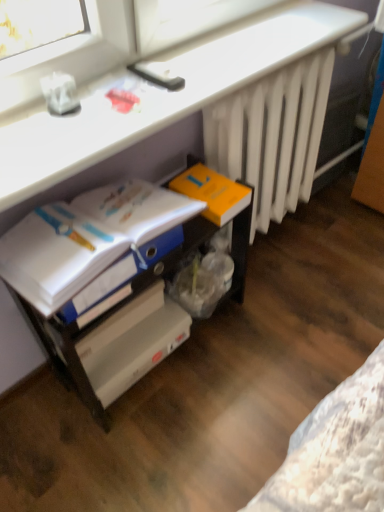
This screenshot has height=512, width=384. Find the location of `orange matte paperback book at center-right`. orange matte paperback book at center-right is located at coordinates (213, 193).

Locate an element on the screen. white plastic file cabinet at lower center is located at coordinates (136, 300).

Where is `white matte radiator at right`? This screenshot has width=384, height=512. white matte radiator at right is located at coordinates (272, 135).

Between blue glossy folder at lower left and white plastic computer at lower left, which one appears on the left side from the viewer's perspective?

blue glossy folder at lower left is more to the left.

From a real-world perspective, is blue glossy folder at lower left over white plastic computer at lower left?

Incorrect, from a real-world perspective, blue glossy folder at lower left is lower than white plastic computer at lower left.

Would you say white plastic computer at lower left is part of blue glossy folder at lower left's contents?

Definitely not — white plastic computer at lower left is not inside blue glossy folder at lower left.

Does blue glossy folder at lower left have a smaller size compared to white plastic file cabinet at lower center?

Correct, blue glossy folder at lower left occupies less space than white plastic file cabinet at lower center.

From the image's perspective, is blue glossy folder at lower left on top of white plastic file cabinet at lower center?

Yes, from the image's perspective, blue glossy folder at lower left is over white plastic file cabinet at lower center.

Are blue glossy folder at lower left and white plastic file cabinet at lower center located far from each other?

blue glossy folder at lower left is near white plastic file cabinet at lower center, not far away.

From a real-world perspective, is blue glossy folder at lower left positioned above or below white plastic file cabinet at lower center?

Clearly, from a real-world perspective, blue glossy folder at lower left is above white plastic file cabinet at lower center.

Who is taller, white plastic computer at lower left or white matte radiator at right?

white matte radiator at right is taller.

Is white plastic computer at lower left oriented away from white matte radiator at right?

white plastic computer at lower left is not turned away from white matte radiator at right.

In the scene shown: Which object is wider, white plastic computer at lower left or white matte radiator at right?

With larger width is white plastic computer at lower left.

Is white plastic computer at lower left positioned beyond the bounds of white matte radiator at right?

Yes.

Which object is wider, white plastic computer at lower left or orange matte paperback book at center-right?

white plastic computer at lower left is wider.

Which is more to the right, white plastic computer at lower left or orange matte paperback book at center-right?

orange matte paperback book at center-right is more to the right.

From a real-world perspective, is white plastic computer at lower left located beneath orange matte paperback book at center-right?

No, from a real-world perspective, white plastic computer at lower left is not under orange matte paperback book at center-right.

Based on the photo, how much distance is there between white plastic computer at lower left and orange matte paperback book at center-right?

12.42 inches.

Considering the sizes of white plastic file cabinet at lower center and white matte radiator at right in the image, is white plastic file cabinet at lower center taller or shorter than white matte radiator at right?

In the image, white plastic file cabinet at lower center appears to be shorter than white matte radiator at right.

Looking at this image, from the image's perspective, which one is positioned higher, white plastic file cabinet at lower center or white matte radiator at right?

white matte radiator at right.

Looking at the image, does white plastic file cabinet at lower center seem bigger or smaller compared to white matte radiator at right?

Considering their sizes, white plastic file cabinet at lower center takes up more space than white matte radiator at right.

Is white plastic file cabinet at lower center facing towards white matte radiator at right?

No, white plastic file cabinet at lower center is not oriented towards white matte radiator at right.

From their relative heights in the image, would you say white matte radiator at right is taller or shorter than blue glossy folder at lower left?

Considering their sizes, white matte radiator at right has more height than blue glossy folder at lower left.

Is white matte radiator at right in front of or behind blue glossy folder at lower left in the image?

white matte radiator at right is positioned farther from the viewer than blue glossy folder at lower left.

Is white matte radiator at right facing away from blue glossy folder at lower left?

No.

Is white matte radiator at right directly adjacent to blue glossy folder at lower left?

No, white matte radiator at right is not in contact with blue glossy folder at lower left.

Are white plastic computer at lower left and blue glossy folder at lower left beside each other?

No, white plastic computer at lower left is not beside blue glossy folder at lower left.

Is the position of white plastic computer at lower left more distant than that of blue glossy folder at lower left?

No, white plastic computer at lower left is in front of blue glossy folder at lower left.

From a real-world perspective, is white plastic computer at lower left positioned above or below blue glossy folder at lower left?

Clearly, from a real-world perspective, white plastic computer at lower left is above blue glossy folder at lower left.

Is white plastic computer at lower left smaller than blue glossy folder at lower left?

No, white plastic computer at lower left is not smaller than blue glossy folder at lower left.

Where is `computer located above the blue glossy folder at lower left (from the image's perspective)`? computer located above the blue glossy folder at lower left (from the image's perspective) is located at coordinates (160, 97).

At what (x,y) coordinates should I click in order to perform the action: click on magazine in front of the white plastic file cabinet at lower center. Please return your answer as a coordinate pair (x, y). Looking at the image, I should click on (87, 239).

Which object lies nearer to the anchor point orange matte paperback book at center-right, white matte radiator at right or white plastic file cabinet at lower center?

white plastic file cabinet at lower center is positioned closer to the anchor orange matte paperback book at center-right.

Considering their positions, is blue glossy folder at lower left positioned closer to white matte radiator at right than white plastic file cabinet at lower center?

white plastic file cabinet at lower center lies closer to white matte radiator at right than the other object.

Which object lies further to the anchor point blue glossy folder at lower left, white plastic computer at lower left or white matte radiator at right?

Among the two, white matte radiator at right is located further to blue glossy folder at lower left.

Considering their positions, is orange matte paperback book at center-right positioned further to blue glossy folder at lower left than white matte radiator at right?

white matte radiator at right is further to blue glossy folder at lower left.

Estimate the real-world distances between objects in this image. Which object is closer to white plastic computer at lower left, white plastic file cabinet at lower center or orange matte paperback book at center-right?

Among the two, orange matte paperback book at center-right is located nearer to white plastic computer at lower left.

When comparing their distances from white plastic computer at lower left, does white matte radiator at right or blue glossy folder at lower left seem closer?

Among the two, blue glossy folder at lower left is located nearer to white plastic computer at lower left.

Which object lies nearer to the anchor point white plastic file cabinet at lower center, white plastic computer at lower left or white matte radiator at right?

Based on the image, white plastic computer at lower left appears to be nearer to white plastic file cabinet at lower center.

From the image, which object appears to be farther from white matte radiator at right, white plastic file cabinet at lower center or orange matte paperback book at center-right?

white plastic file cabinet at lower center lies further to white matte radiator at right than the other object.

The image size is (384, 512). Identify the location of paperback book located between blue glossy folder at lower left and white matte radiator at right in the left-right direction. (213, 193).

Locate an element on the screen. The height and width of the screenshot is (512, 384). file cabinet positioned between blue glossy folder at lower left and orange matte paperback book at center-right from near to far is located at coordinates (136, 300).

Where is `radiator that lies between white plastic computer at lower left and white plastic file cabinet at lower center from top to bottom`? The image size is (384, 512). radiator that lies between white plastic computer at lower left and white plastic file cabinet at lower center from top to bottom is located at coordinates pos(272,135).

Locate an element on the screen. The image size is (384, 512). radiator between white plastic computer at lower left and orange matte paperback book at center-right from front to back is located at coordinates (272, 135).